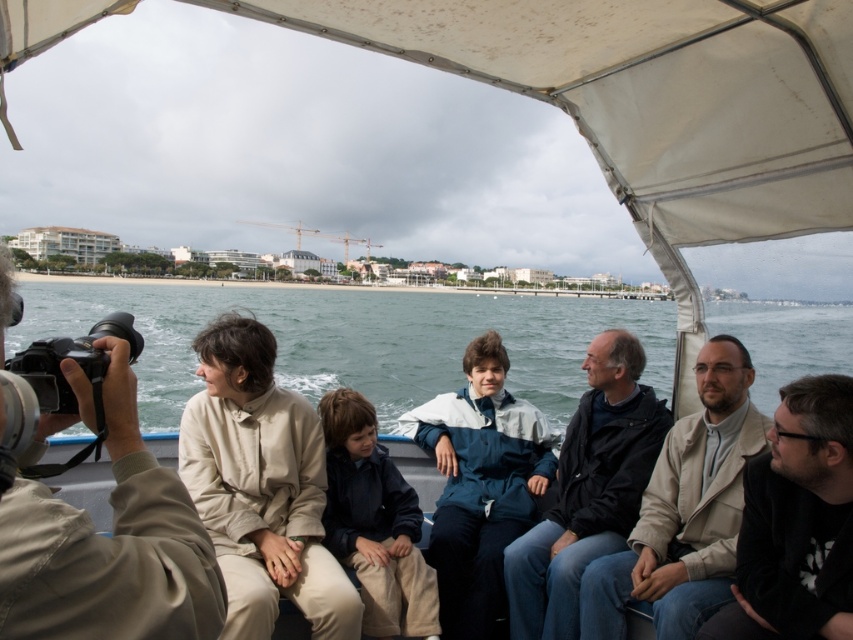
You are planning to take a photo of the blue water at lower center and the dark blue jacket at center. Which object should you focus on first if you want to capture both in one shot without moving the camera?

The blue water at lower center is wider than the dark blue jacket at center, so you should focus on the blue water at lower center first to ensure it fits within the frame.

You are standing at the center of the boat and want to hand a camera to the person wearing the black matte jacket at lower right. In which direction should you move to reach them?

The black matte jacket at lower right is located at point 0.817 on the x axis and 0.934 on the y axis, so you should move towards the lower right direction to reach them.

You are standing on the deck of a boat and see the black matte jacket at lower right. If you want to take a photo of it with your smartphone camera, which has a maximum zoom range of 10 meters, will you be able to capture it clearly without moving closer?

The black matte jacket at lower right is 26.91 meters away from the viewer. Since the smartphone camera has a maximum zoom range of 10 meters, it cannot capture the jacket clearly without moving closer.